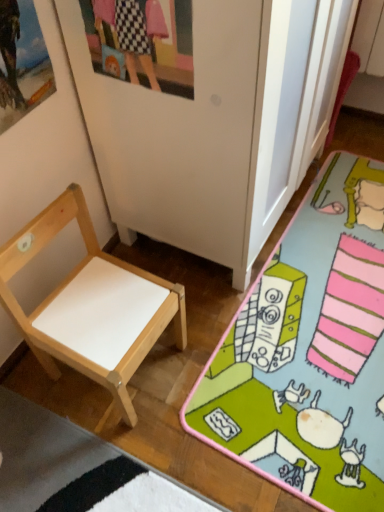
Where is `free spot below natural wood chair at left (from a real-world perspective)`? Image resolution: width=384 pixels, height=512 pixels. free spot below natural wood chair at left (from a real-world perspective) is located at coordinates (139, 374).